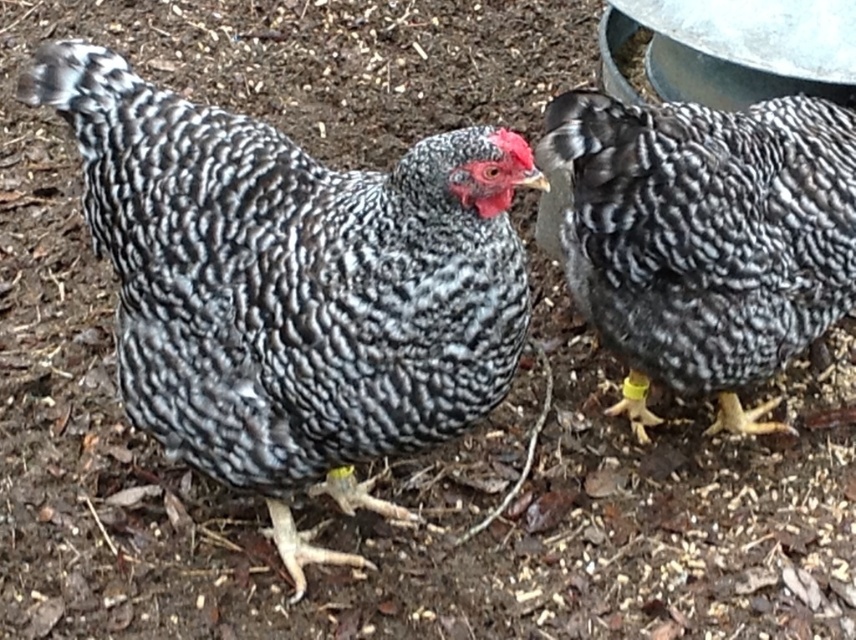
You are a farmer who needs to identify which chicken is taller. You see the speckled feathered chicken at center and the speckled feathered chicken at right. Which one is taller?

The speckled feathered chicken at center is taller than the speckled feathered chicken at right.

Where is the speckled feathered chicken at center located in the image?

The speckled feathered chicken at center is located at point (292, 285).

You are a farmer checking the coop. You notice a specific point at coordinates (292, 285). Which chicken is this point located on?

The point at coordinates (292, 285) is located on the speckled feathered chicken at center.